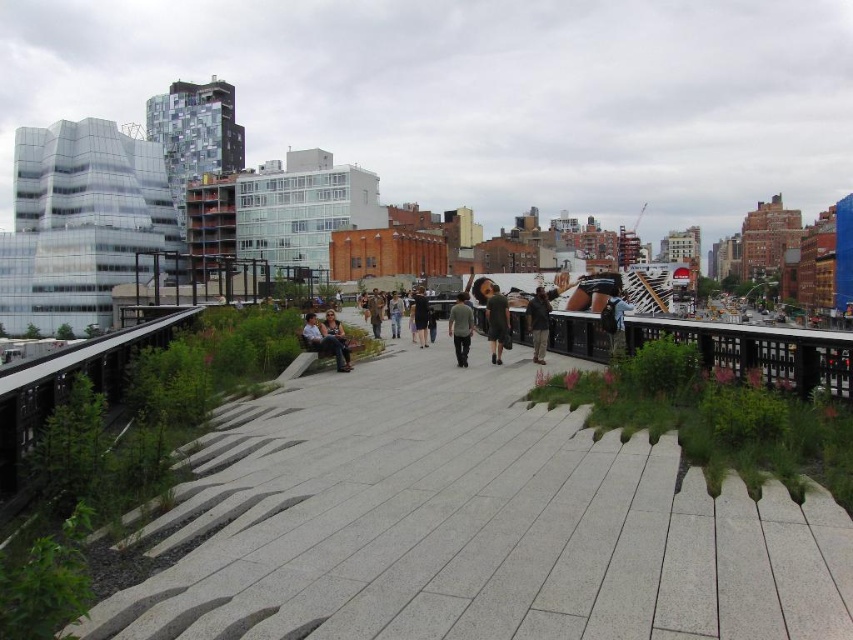
Question: Is gray textured pavement at center further to camera compared to matte black bench at center?

Choices:
 (A) yes
 (B) no

Answer: (B)

Question: Which point appears closest to the camera in this image?

Choices:
 (A) (296, 460)
 (B) (489, 326)
 (C) (618, 304)

Answer: (A)

Question: Can you confirm if dark green dress at center is positioned to the left of matte black bench at center?

Choices:
 (A) no
 (B) yes

Answer: (A)

Question: Which point is closer to the camera?

Choices:
 (A) matte black bench at center
 (B) dark brown leather jacket at center
 (C) gray textured pavement at center

Answer: (C)

Question: Which of these objects is positioned farthest from the dark gray cotton shirt at center?

Choices:
 (A) denim pants at center
 (B) dark brown leather jacket at center
 (C) matte black bench at center
 (D) dark blue jeans at center

Answer: (D)

Question: Can you confirm if dark green dress at center is positioned to the right of denim pants at center?

Choices:
 (A) yes
 (B) no

Answer: (A)